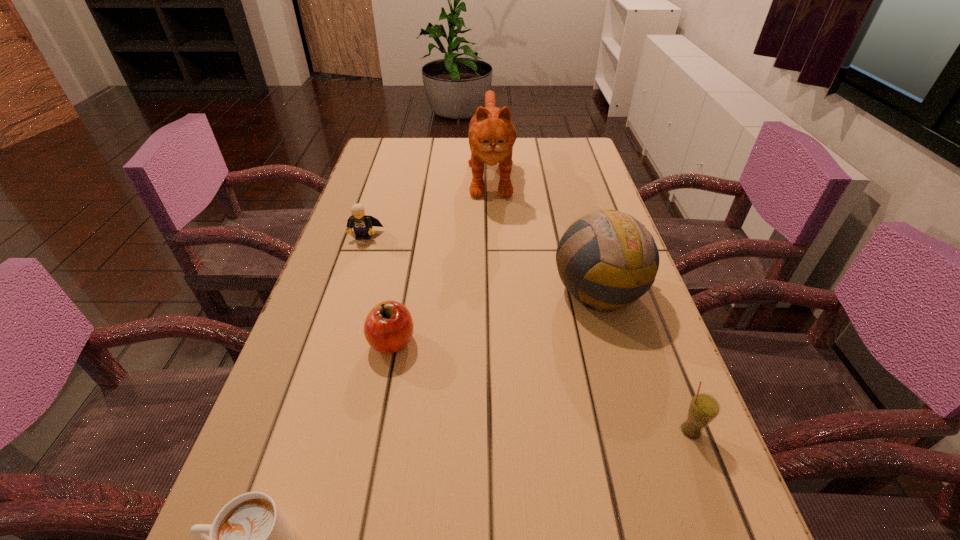
In the image, there is a desktop. Where is `vacant space at the far left corner`? This screenshot has height=540, width=960. vacant space at the far left corner is located at coordinates (379, 142).

In the image, there is a desktop. Where is `vacant space at the far right corner`? The height and width of the screenshot is (540, 960). vacant space at the far right corner is located at coordinates (565, 152).

Identify the location of unoccupied area between the third tallest object and the volleyball. (645, 361).

Locate an element on the screen. free spot between the third object from right to left and the apple is located at coordinates (442, 256).

Locate an element on the screen. The height and width of the screenshot is (540, 960). blank region between the fifth shortest object and the second nearest object is located at coordinates (645, 361).

You are a GUI agent. You are given a task and a screenshot of the screen. Output one action in this format:
    pyautogui.click(x=<x>, y=<y>)
    Task: Click on the empty location between the apple and the second farthest object
    This screenshot has width=960, height=540.
    Given the screenshot: What is the action you would take?
    pyautogui.click(x=378, y=289)

Identify which object is the second nearest to the Lego. Please provide its 2D coordinates. Your answer should be formatted as a tuple, i.e. [(x, y)], where the tuple contains the x and y coordinates of a point satisfying the conditions above.

[(388, 328)]

Select which object is the fourth closest to the volleyball. Please provide its 2D coordinates. Your answer should be formatted as a tuple, i.e. [(x, y)], where the tuple contains the x and y coordinates of a point satisfying the conditions above.

[(362, 224)]

Find the location of a particular element. The width and height of the screenshot is (960, 540). free region that satisfies the following two spatial constraints: 1. on the front-facing side of the fifth nearest object; 2. on the left side of the apple is located at coordinates (329, 342).

You are a GUI agent. You are given a task and a screenshot of the screen. Output one action in this format:
    pyautogui.click(x=<x>, y=<y>)
    Task: Click on the free location that satisfies the following two spatial constraints: 1. on the front-facing side of the fifth nearest object; 2. on the left side of the volleyball
    The width and height of the screenshot is (960, 540).
    Given the screenshot: What is the action you would take?
    pyautogui.click(x=347, y=291)